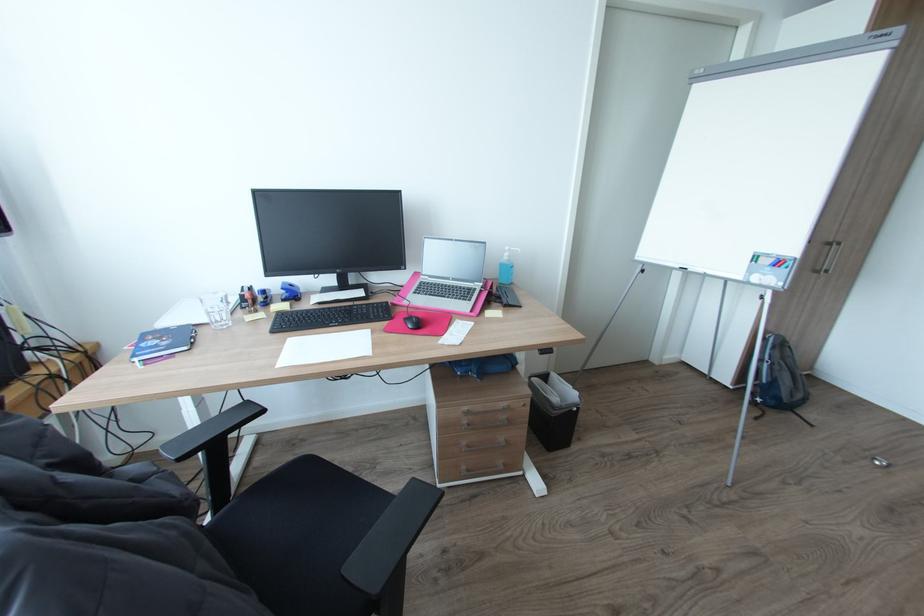
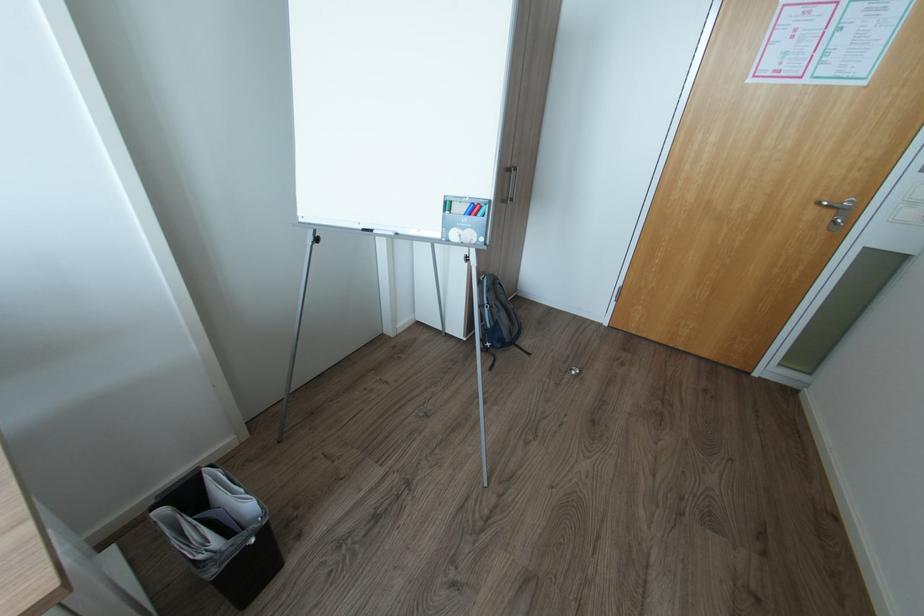
Locate, in the second image, the point that corresponds to [642,270] in the first image.

(315, 238)